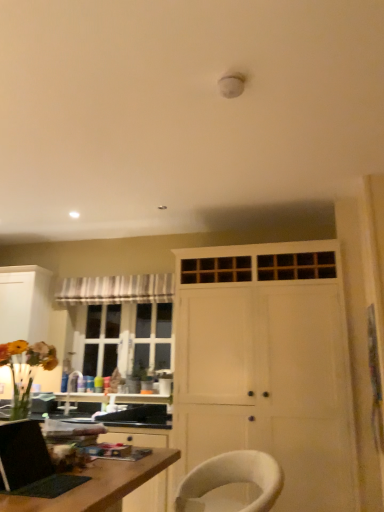
Question: Is white matte cabinet at left, which appears as the second cabinetry when viewed from the front, in front of or behind wooden desk at lower left in the image?

Choices:
 (A) front
 (B) behind

Answer: (B)

Question: Does point (13, 279) appear closer or farther from the camera than point (76, 501)?

Choices:
 (A) closer
 (B) farther

Answer: (B)

Question: Which of these objects is positioned closest to the striped fabric curtain at upper left?

Choices:
 (A) matte black laptop at lower left
 (B) white fabric chair at lower center
 (C) white matte cabinet at left, the first cabinetry when ordered from left to right
 (D) white wood cabinet at center, the first cabinetry in the right-to-left sequence
 (E) wooden desk at lower left

Answer: (C)

Question: Which object is the closest to the matte black laptop at lower left?

Choices:
 (A) white matte cabinet at left, the first cabinetry when ordered from left to right
 (B) striped fabric curtain at upper left
 (C) white wood cabinet at center, which ranks as the 2th cabinetry in left-to-right order
 (D) white fabric chair at lower center
 (E) wooden desk at lower left

Answer: (E)